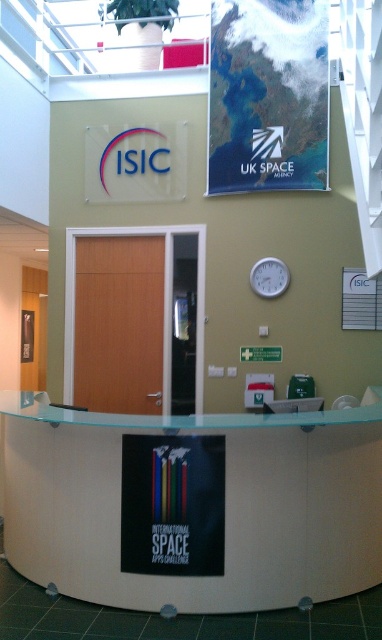
Question: Is matte paper poster at upper center smaller than white plastic clock at center?

Choices:
 (A) no
 (B) yes

Answer: (A)

Question: Which of these objects is positioned closest to the matte paper poster at upper center?

Choices:
 (A) white glossy information desk at center
 (B) white plastic clock at center

Answer: (B)

Question: Is the position of white glossy information desk at center more distant than that of matte paper poster at upper center?

Choices:
 (A) no
 (B) yes

Answer: (A)

Question: Does matte paper poster at upper center lie behind white plastic clock at center?

Choices:
 (A) yes
 (B) no

Answer: (B)

Question: Which point is closer to the camera?

Choices:
 (A) (289, 531)
 (B) (286, 84)
 (C) (276, 276)

Answer: (A)

Question: Which object is closer to the camera taking this photo?

Choices:
 (A) matte paper poster at upper center
 (B) white plastic clock at center

Answer: (A)